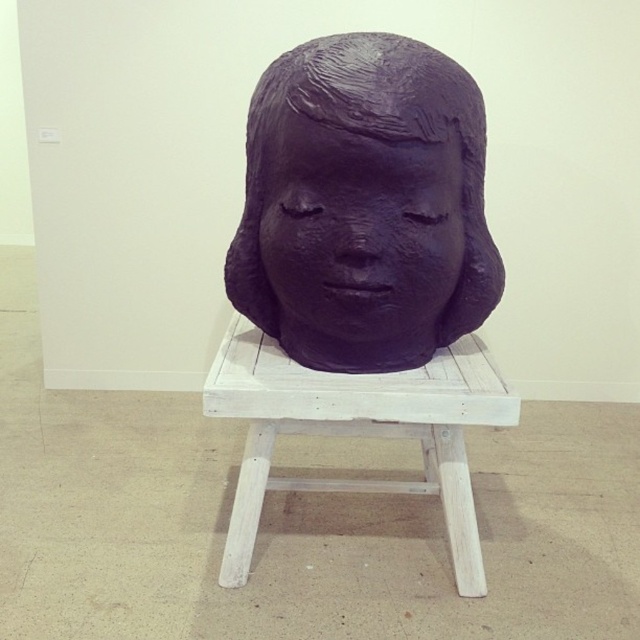
Is the position of purple matte head at center more distant than that of purple matte sculpture at center?

No, purple matte head at center is closer to the viewer.

Can you confirm if purple matte head at center is positioned above purple matte sculpture at center?

Actually, purple matte head at center is below purple matte sculpture at center.

Does point (259, 324) lie in front of point (296, 244)?

No, (259, 324) is further to viewer.

Locate an element on the screen. The image size is (640, 640). purple matte head at center is located at coordinates (362, 276).

Does purple matte head at center appear on the right side of white wood stool at center?

Yes, purple matte head at center is to the right of white wood stool at center.

Does purple matte head at center have a larger size compared to white wood stool at center?

Yes, purple matte head at center is bigger than white wood stool at center.

I want to click on purple matte head at center, so click(x=362, y=276).

In the scene shown: Is purple matte sculpture at center shorter than white wood stool at center?

Correct, purple matte sculpture at center is not as tall as white wood stool at center.

Between point (440, 232) and point (291, 376), which one is positioned in front?

Point (440, 232)

Find the location of a particular element. The width and height of the screenshot is (640, 640). purple matte sculpture at center is located at coordinates (358, 234).